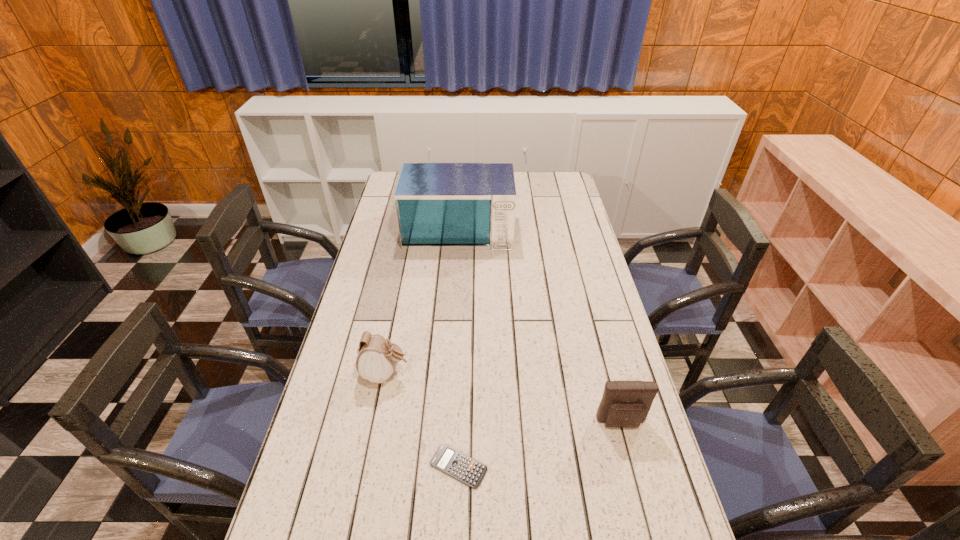
You are a GUI agent. You are given a task and a screenshot of the screen. Output one action in this format:
    pyautogui.click(x=<x>, y=<y>)
    Task: Click on the free spot between the third nearest object and the third farthest object
    This screenshot has width=960, height=540.
    Given the screenshot: What is the action you would take?
    pyautogui.click(x=503, y=399)

You are a GUI agent. You are given a task and a screenshot of the screen. Output one action in this format:
    pyautogui.click(x=<x>, y=<y>)
    Task: Click on the vacant region between the left pouch and the nearest object
    This screenshot has width=960, height=540.
    Given the screenshot: What is the action you would take?
    pyautogui.click(x=422, y=420)

Locate an element on the screen. Image resolution: width=960 pixels, height=540 pixels. free space that is in between the calculator and the left pouch is located at coordinates (422, 420).

This screenshot has height=540, width=960. I want to click on unoccupied position between the farther pouch and the tallest object, so click(422, 300).

Locate an element on the screen. free space between the left pouch and the tallest object is located at coordinates (422, 300).

Find the location of a particular element. vacant space that's between the shortest object and the third farthest object is located at coordinates (540, 444).

Locate an element on the screen. The width and height of the screenshot is (960, 540). unoccupied area between the farther pouch and the rightmost object is located at coordinates (503, 399).

Identify the location of free spot between the rightmost object and the nearest object. coord(540,444).

Identify which object is the second nearest to the microwave oven. Please provide its 2D coordinates. Your answer should be formatted as a tuple, i.e. [(x, y)], where the tuple contains the x and y coordinates of a point satisfying the conditions above.

[(625, 404)]

Point out which object is positioned as the nearest to the second nearest object. Please provide its 2D coordinates. Your answer should be formatted as a tuple, i.e. [(x, y)], where the tuple contains the x and y coordinates of a point satisfying the conditions above.

[(450, 461)]